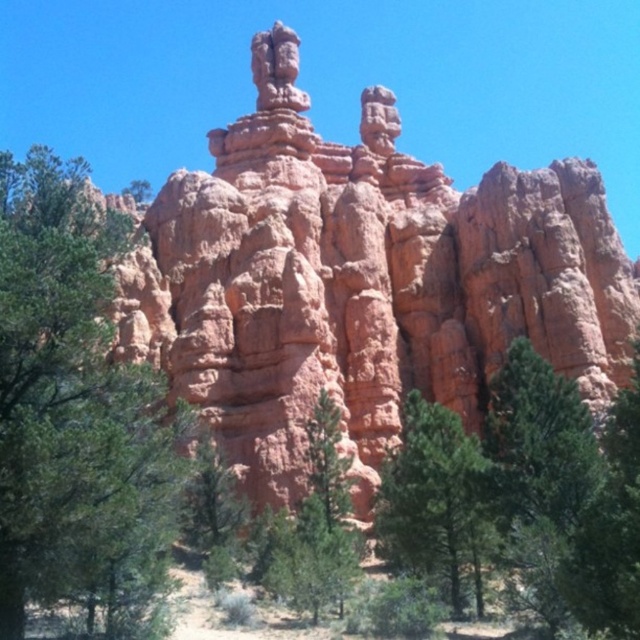
Question: Is green matte tree at left above green matte tree at center?

Choices:
 (A) no
 (B) yes

Answer: (B)

Question: Is green matte tree at left below green matte tree at center?

Choices:
 (A) no
 (B) yes

Answer: (A)

Question: Is green matte tree at left thinner than green matte tree at center?

Choices:
 (A) yes
 (B) no

Answer: (B)

Question: Which point is closer to the camera?

Choices:
 (A) green matte tree at left
 (B) green matte tree at center

Answer: (A)

Question: Which object appears farthest from the camera in this image?

Choices:
 (A) green matte tree at center
 (B) green matte tree at left

Answer: (A)

Question: Among these objects, which one is farthest from the camera?

Choices:
 (A) green matte tree at left
 (B) green matte tree at center

Answer: (B)